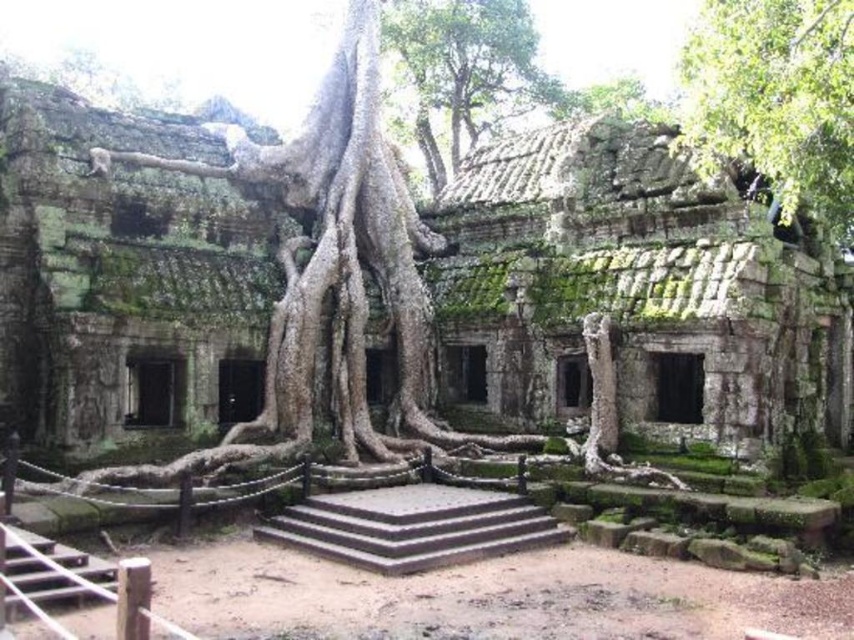
Question: Which point is closer to the camera taking this photo?

Choices:
 (A) (469, 145)
 (B) (822, 104)

Answer: (B)

Question: From the image, what is the correct spatial relationship of green mossy stone ruins at center in relation to green mossy tree at upper center?

Choices:
 (A) right
 (B) left

Answer: (B)

Question: Which point is farther to the camera?

Choices:
 (A) (293, 355)
 (B) (437, 58)
 (C) (825, 161)

Answer: (B)

Question: Is green mossy stone ruins at center above green mossy tree at upper center?

Choices:
 (A) no
 (B) yes

Answer: (A)

Question: Which point appears closest to the camera in this image?

Choices:
 (A) (396, 36)
 (B) (695, 93)
 (C) (124, 376)

Answer: (C)

Question: Does green leafy tree at upper right have a larger size compared to green mossy tree at upper center?

Choices:
 (A) yes
 (B) no

Answer: (B)